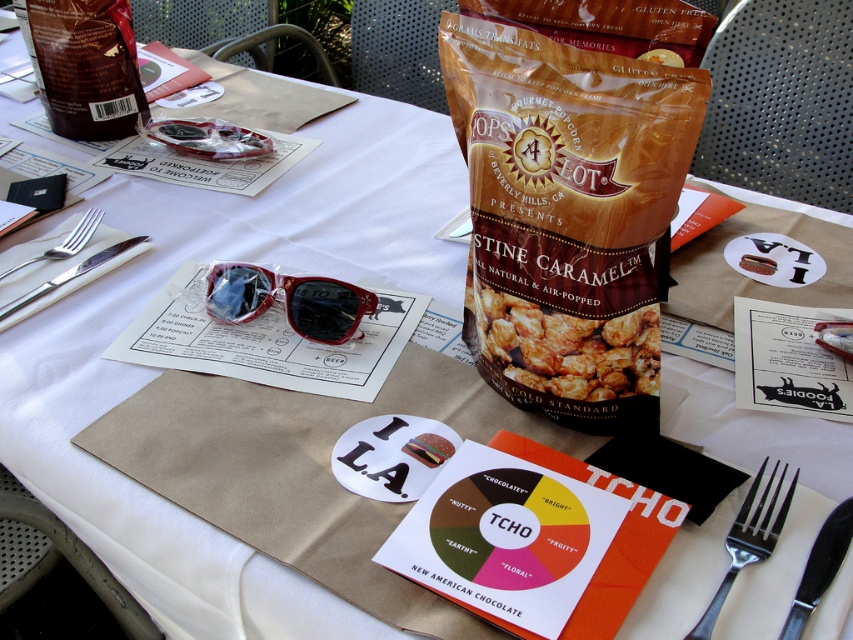
Question: Can you confirm if silver metallic fork at lower right is positioned below satin silver fork at left?

Choices:
 (A) yes
 (B) no

Answer: (A)

Question: Does caramelized popcorn at center have a larger size compared to silvermetallicfork and knife at left?

Choices:
 (A) no
 (B) yes

Answer: (A)

Question: Is silvermetallicfork and knife at left to the right of satin silver fork at left from the viewer's perspective?

Choices:
 (A) yes
 (B) no

Answer: (A)

Question: Which object is closer to the camera taking this photo?

Choices:
 (A) silvermetallicfork and knife at left
 (B) black metal knife at lower right
 (C) caramelized popcorn at center

Answer: (B)

Question: Which of the following is the farthest from the observer?

Choices:
 (A) (537, 326)
 (B) (759, 481)
 (C) (811, 576)

Answer: (A)

Question: Which of the following is the closest to the observer?

Choices:
 (A) caramelized popcorn at center
 (B) shiny red plastic sunglasses at center

Answer: (A)